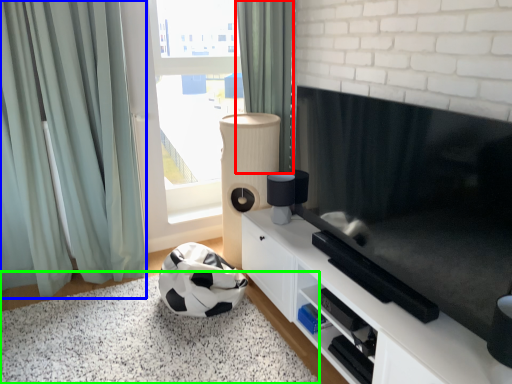
Question: Estimate the real-world distances between objects in this image. Which object is farther from curtain (highlighted by a red box), curtain (highlighted by a blue box) or plain (highlighted by a green box)?

Choices:
 (A) curtain
 (B) plain

Answer: (B)